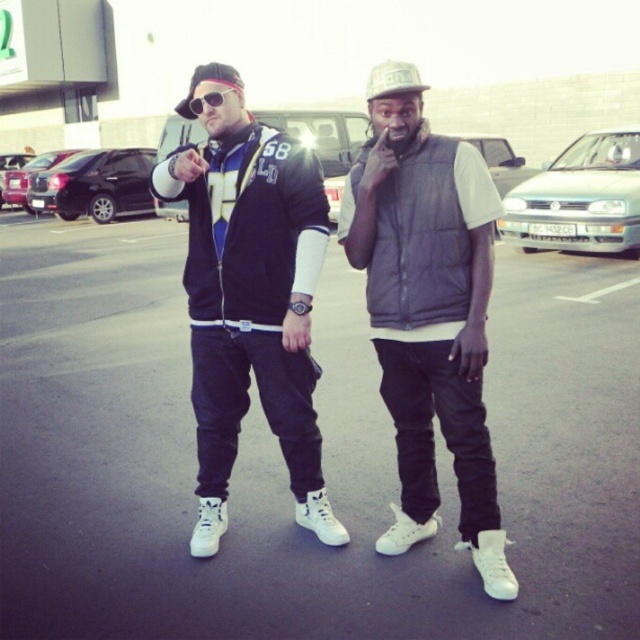
Question: In this image, where is matte black jacket at center located relative to matte black sunglasses at center?

Choices:
 (A) left
 (B) right

Answer: (B)

Question: Does matte gray vest at center lie in front of matte black sunglasses at center?

Choices:
 (A) no
 (B) yes

Answer: (B)

Question: Estimate the real-world distances between objects in this image. Which object is closer to the white fabric baseball cap at center?

Choices:
 (A) matte black jacket at center
 (B) matte gray vest at center

Answer: (B)

Question: Which object appears closest to the camera in this image?

Choices:
 (A) matte black jacket at center
 (B) matte gray vest at center
 (C) white fabric baseball cap at center
 (D) matte black sunglasses at center

Answer: (C)

Question: Does white fabric baseball cap at center appear on the left side of matte black sunglasses at center?

Choices:
 (A) no
 (B) yes

Answer: (A)

Question: Which of the following is the closest to the observer?

Choices:
 (A) (387, 67)
 (B) (276, 236)

Answer: (A)